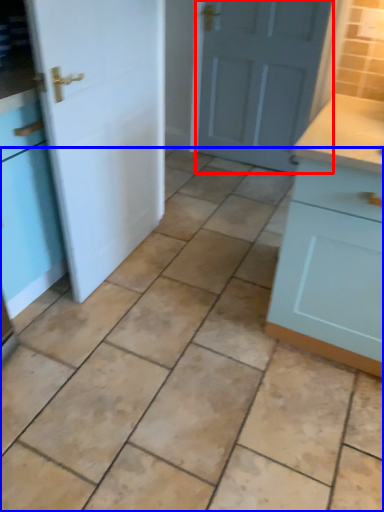
Question: Which object is closer to the camera taking this photo, door (highlighted by a red box) or ceramic tile (highlighted by a blue box)?

Choices:
 (A) door
 (B) ceramic tile

Answer: (B)